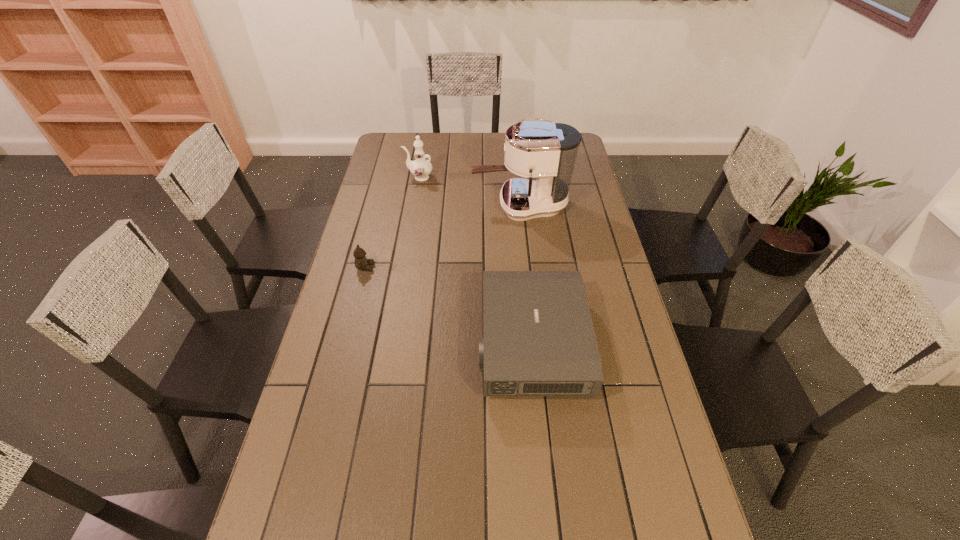
What are the coordinates of `coffee maker that is at the right edge` in the screenshot? It's located at (547, 151).

The height and width of the screenshot is (540, 960). In order to click on projector present at the right edge in this screenshot , I will do `click(538, 339)`.

In the image, there is a desktop. Where is `vacant space at the far edge`? The image size is (960, 540). vacant space at the far edge is located at coordinates (448, 136).

You are a GUI agent. You are given a task and a screenshot of the screen. Output one action in this format:
    pyautogui.click(x=<x>, y=<y>)
    Task: Click on the vacant space at the left edge of the desktop
    This screenshot has height=540, width=960.
    Given the screenshot: What is the action you would take?
    pyautogui.click(x=327, y=368)

Image resolution: width=960 pixels, height=540 pixels. In the image, there is a desktop. What are the coordinates of `vacant space at the right edge` in the screenshot? It's located at (602, 256).

The height and width of the screenshot is (540, 960). I want to click on free spot at the far left corner of the desktop, so click(x=405, y=138).

This screenshot has height=540, width=960. I want to click on blank region between the shortest object and the second shortest object, so click(x=448, y=305).

Locate an element on the screen. Image resolution: width=960 pixels, height=540 pixels. empty space between the third object from right to left and the leftmost object is located at coordinates (393, 222).

You are a GUI agent. You are given a task and a screenshot of the screen. Output one action in this format:
    pyautogui.click(x=<x>, y=<y>)
    Task: Click on the vacant space that is in between the tallest object and the third farthest object
    
    Given the screenshot: What is the action you would take?
    pyautogui.click(x=444, y=237)

The height and width of the screenshot is (540, 960). I want to click on free space between the third farthest object and the second shortest object, so click(448, 305).